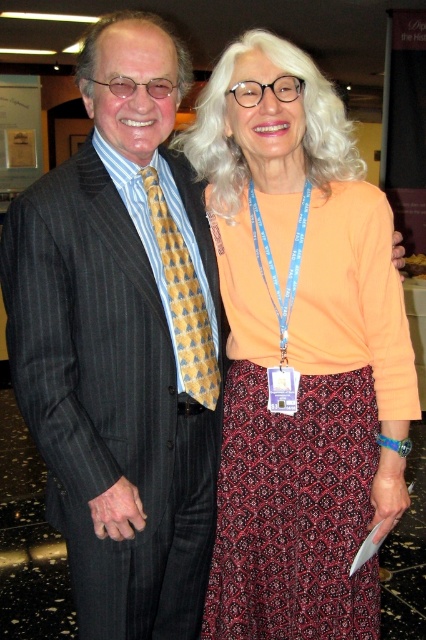
You are organizing a photo shoot and need to ensure that the matte orange blouse at center and the matte black suit at center are visible in the frame. Given their height difference, which one might you need to adjust the camera angle for to capture both properly?

The matte orange blouse at center has a lesser height compared to the matte black suit at center. To capture both properly, you might need to lower the camera angle slightly to ensure the shorter blouse remains visible while still framing the taller suit adequately.

You are a photographer trying to capture a closeup shot of the matte orange blouse at center and dark red patterned skirt at center. Given that your camera can only focus on one object at a time, which object should you adjust the focus to first if you want to ensure the wider one is in focus?

The matte orange blouse at center has a larger width than the dark red patterned skirt at center, so you should adjust the focus to the matte orange blouse at center first to ensure the wider object is in focus.

You are a photographer at a conference and want to capture a closeup shot of both the matte black suit at center and the dark red patterned skirt at center. The camera you are using has a lens that can focus on objects within a 10 inch range. Can you fit both items in the frame without moving the camera?

The matte black suit at center and dark red patterned skirt at center are 10.68 inches apart. Since the distance between them exceeds the camera lens range of 10 inches, you cannot fit both items in the frame without moving the camera.